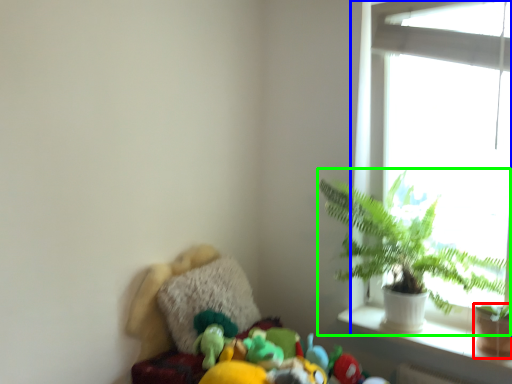
Question: Considering the real-world distances, which object is farthest from flowerpot (highlighted by a red box)? window (highlighted by a blue box) or houseplant (highlighted by a green box)?

Choices:
 (A) window
 (B) houseplant

Answer: (A)